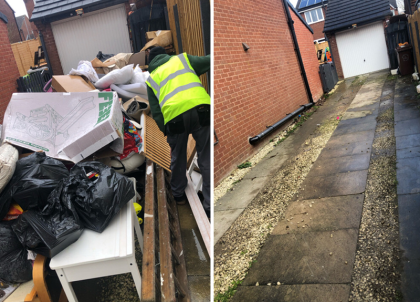
Where is `ride side of white table`? The height and width of the screenshot is (302, 420). ride side of white table is located at coordinates (103, 269).